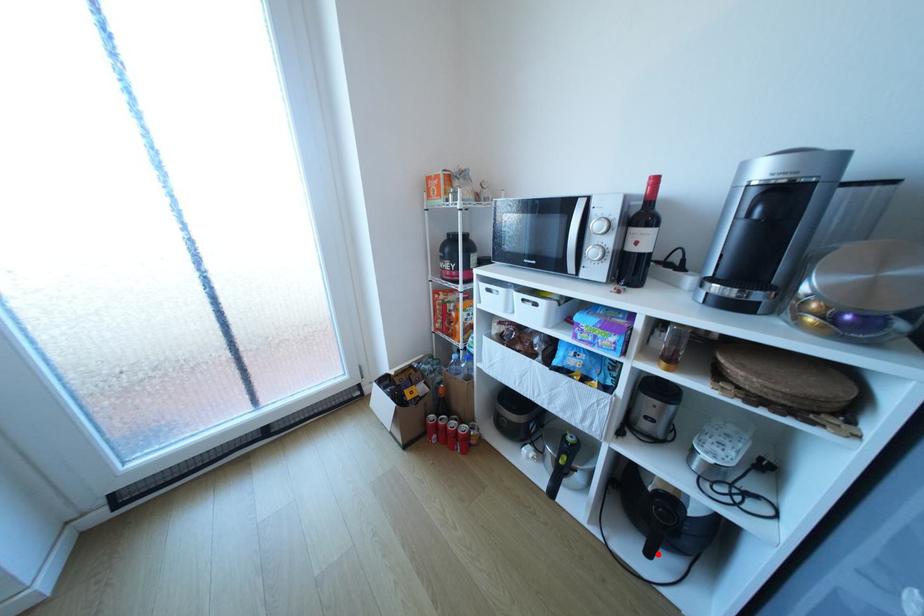
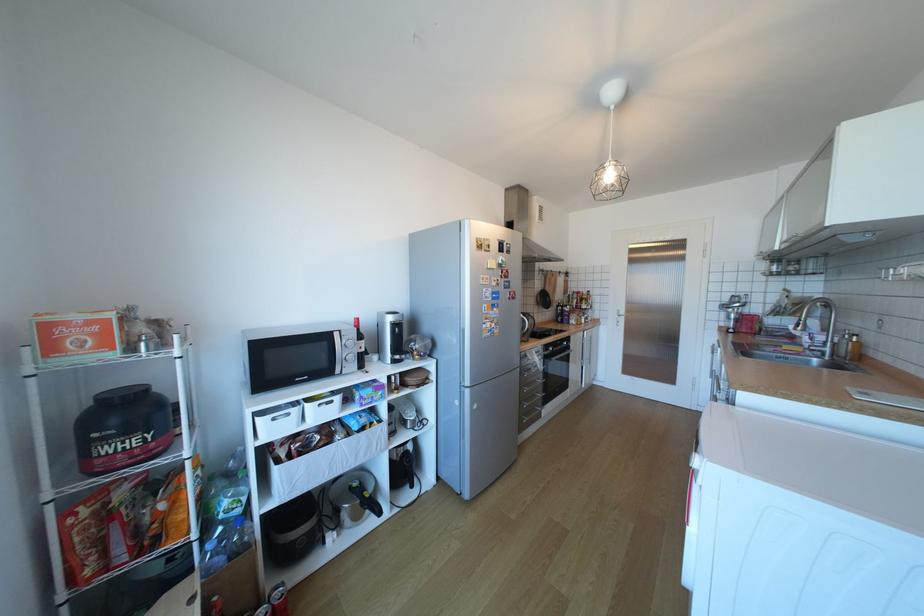
Question: I am providing you with two images of the same scene from different viewpoints. Image1 has a red point marked. In image2, the corresponding 3D location appears at what relative position? Reply with the corresponding letter.

Choices:
 (A) Closer
 (B) Farther

Answer: (B)